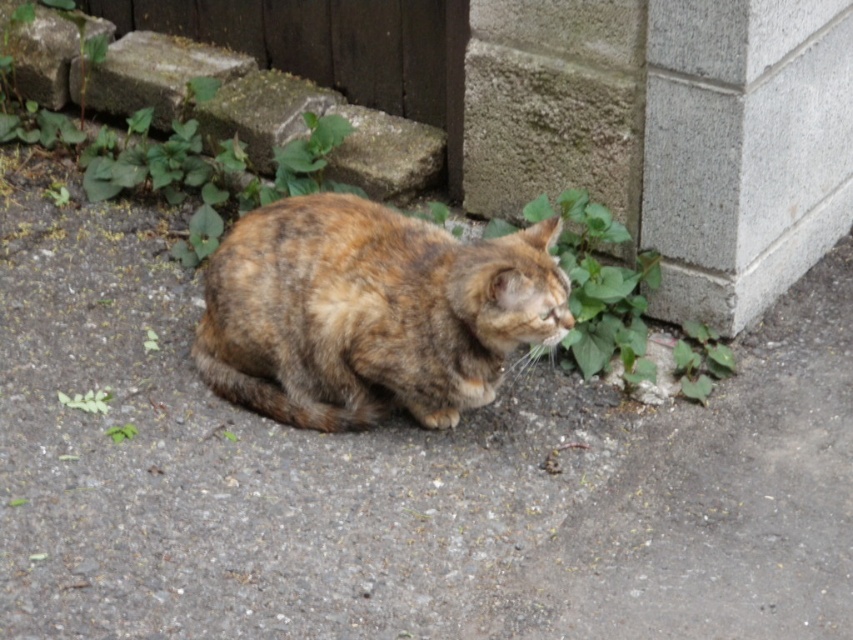
You are a photographer trying to capture a closeup of the tabby fur cat at center. You need to ensure that the gray rough concrete at lower right doesn t distract the viewer. Based on their widths, can you determine if the cat will be the dominant subject in the frame?

The gray rough concrete at lower right is wider than the tabby fur cat at center, so the concrete might distract the viewer more than the cat, making it less likely the cat will be the dominant subject.